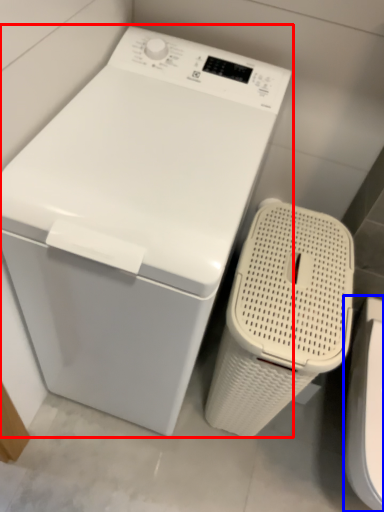
Question: Which object appears closest to the camera in this image, washing machine (highlighted by a red box) or washer (highlighted by a blue box)?

Choices:
 (A) washing machine
 (B) washer

Answer: (A)